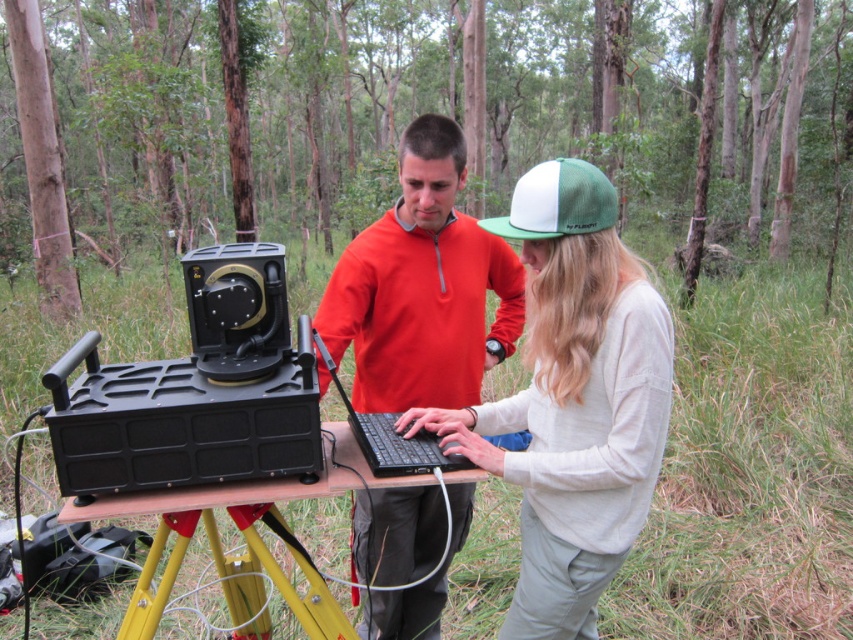
Question: Which of the following is the farthest from the observer?

Choices:
 (A) white knit sweater at center
 (B) green matte forest at center

Answer: (B)

Question: Which point is farther to the camera?

Choices:
 (A) (67, 164)
 (B) (592, 424)
 (C) (509, 275)
 (D) (241, 586)

Answer: (A)

Question: Where is white knit sweater at center located in relation to matte orange sweater at center in the image?

Choices:
 (A) right
 (B) left

Answer: (A)

Question: Can you confirm if green matte forest at center is positioned to the left of yellow metal tripod at lower center?

Choices:
 (A) yes
 (B) no

Answer: (A)

Question: Among these points, which one is nearest to the camera?

Choices:
 (A) (498, 259)
 (B) (374, 420)

Answer: (B)

Question: Is green matte forest at center bigger than yellow metal tripod at lower center?

Choices:
 (A) no
 (B) yes

Answer: (B)